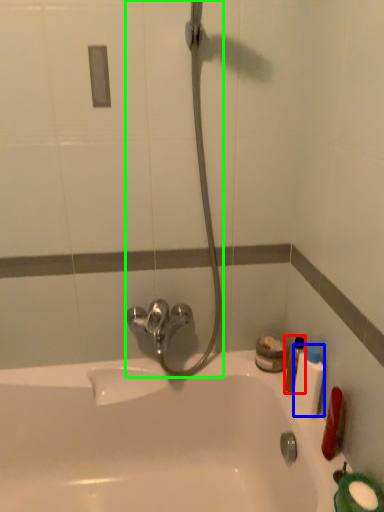
Question: Which object is positioned closest to mouthwash (highlighted by a red box)? Select from mouthwash (highlighted by a blue box) and shower (highlighted by a green box).

Choices:
 (A) mouthwash
 (B) shower

Answer: (A)